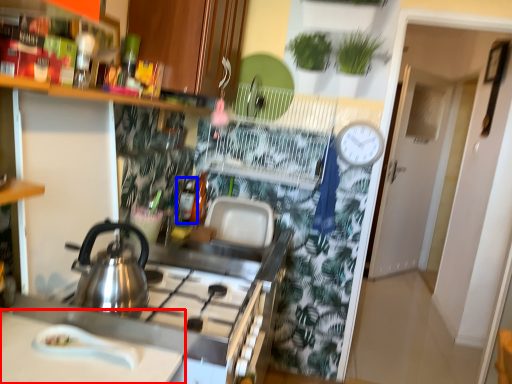
Question: Which point is further to the camera, countertop (highlighted by a red box) or bottle (highlighted by a blue box)?

Choices:
 (A) countertop
 (B) bottle

Answer: (B)